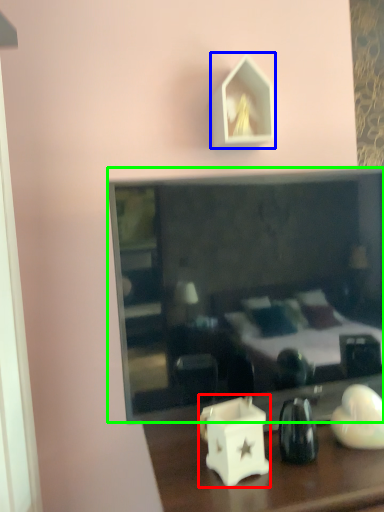
Question: Which is nearer to the candle holder (highlighted by a red box)? picture frame (highlighted by a blue box) or mirror (highlighted by a green box).

Choices:
 (A) picture frame
 (B) mirror

Answer: (B)